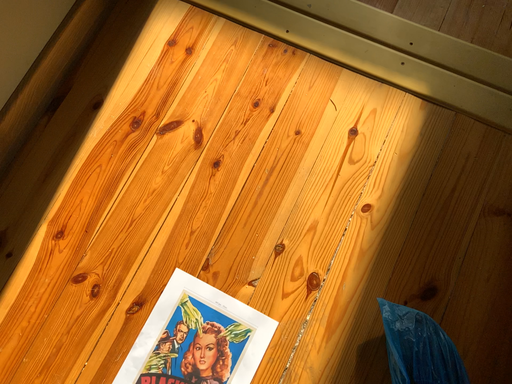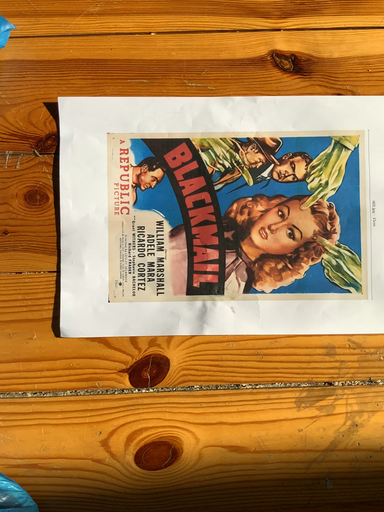
Question: How did the camera likely rotate when shooting the video?

Choices:
 (A) rotated downward
 (B) rotated upward

Answer: (A)